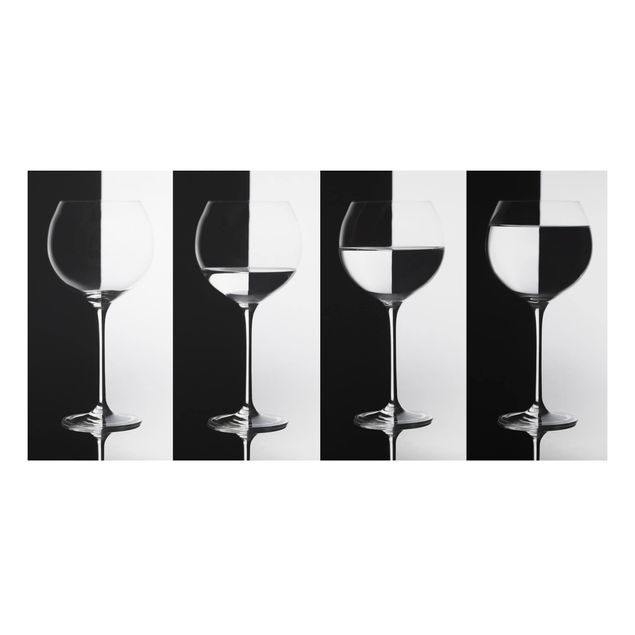
Where is `wine glass stem`? wine glass stem is located at coordinates (100, 331), (246, 359), (395, 361), (540, 373).